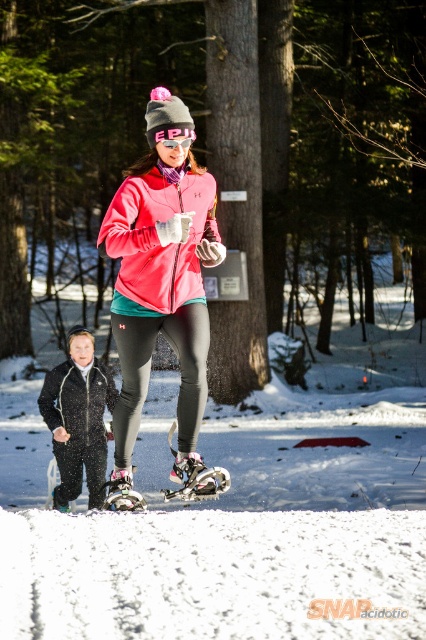
You are planning to place a 3.5 meter long sled between the black fleece jacket at lower left and the brushed metal snowshoe at lower center. Based on the scene, will the sled fit in the space between them?

The distance between the black fleece jacket at lower left and the brushed metal snowshoe at lower center is 2.75 meters. Since the sled is 3.5 meters long, it will not fit in the space between them.